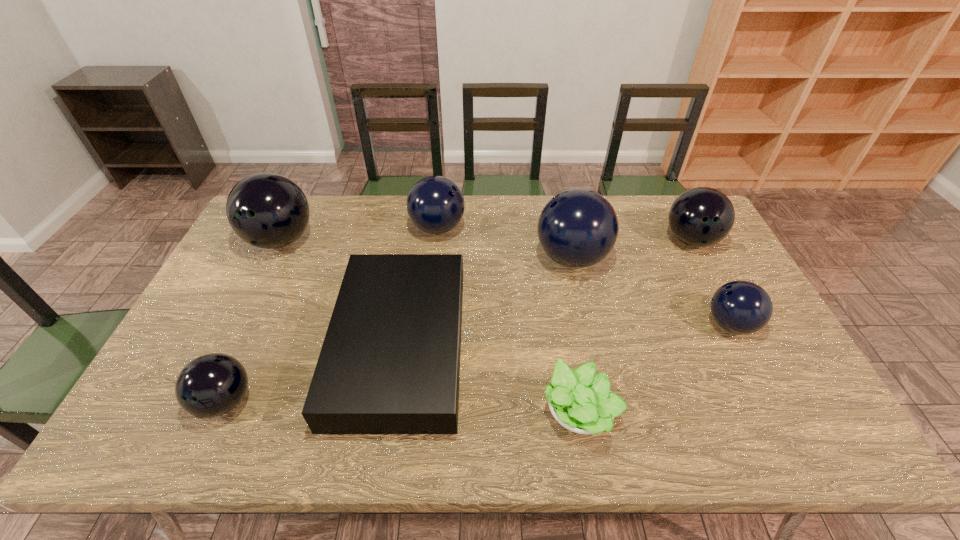
The image size is (960, 540). Identify the location of unoccupied area between the second blue bowling ball from left to right and the biggest black bowling ball. (426, 249).

Locate an element on the screen. This screenshot has width=960, height=540. empty location between the smallest blue bowling ball and the second blue bowling ball from right to left is located at coordinates (651, 291).

I want to click on free space between the smallest black bowling ball and the nearest blue bowling ball, so (478, 363).

Locate which object ranks second in proximity to the nearest bowling ball. Please provide its 2D coordinates. Your answer should be formatted as a tuple, i.e. [(x, y)], where the tuple contains the x and y coordinates of a point satisfying the conditions above.

[(266, 210)]

Identify the location of object that is the fifth closest to the green lettuce. (435, 204).

What are the coordinates of `bowling ball that is the closest one to the biggest blue bowling ball` in the screenshot? It's located at (703, 216).

Where is `bowling ball that is the fifth closest one to the biggest black bowling ball`? This screenshot has height=540, width=960. bowling ball that is the fifth closest one to the biggest black bowling ball is located at coordinates (742, 307).

This screenshot has height=540, width=960. I want to click on blue bowling ball that is the closest to the rightmost blue bowling ball, so click(x=577, y=228).

Identify the location of blue bowling ball that is the closest one to the CD player. This screenshot has height=540, width=960. (435, 204).

Image resolution: width=960 pixels, height=540 pixels. Identify the location of black bowling ball that is the second closest to the third bowling ball from right to left. (266, 210).